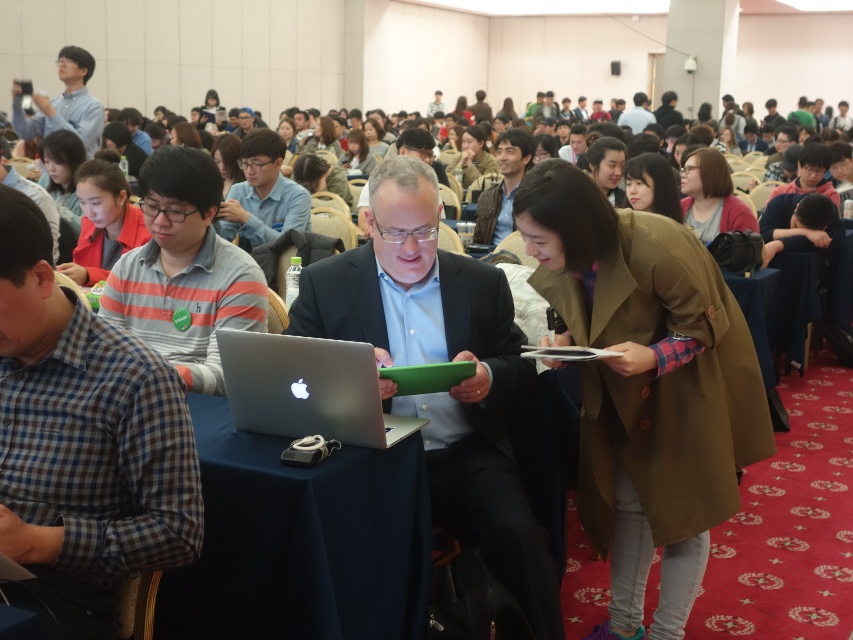
Question: Does blue fabric table at center have a lesser width compared to matte gray shirt at upper center?

Choices:
 (A) yes
 (B) no

Answer: (B)

Question: Which of the following is the closest to the observer?

Choices:
 (A) (16, 195)
 (B) (271, 145)
 (C) (236, 344)
 (D) (419, 600)

Answer: (A)

Question: Does striped cotton polo shirt at center appear under matte black jacket at upper center?

Choices:
 (A) yes
 (B) no

Answer: (A)

Question: Which point is farther from the camera taking this photo?

Choices:
 (A) (480, 209)
 (B) (55, 108)
 (C) (225, 244)

Answer: (B)

Question: Is striped cotton polo shirt at center above silver metallic laptop at center?

Choices:
 (A) yes
 (B) no

Answer: (A)

Question: Which is farther from the matte gray shirt at upper center?

Choices:
 (A) brown textured jacket at upper center
 (B) matte black suit at center

Answer: (B)